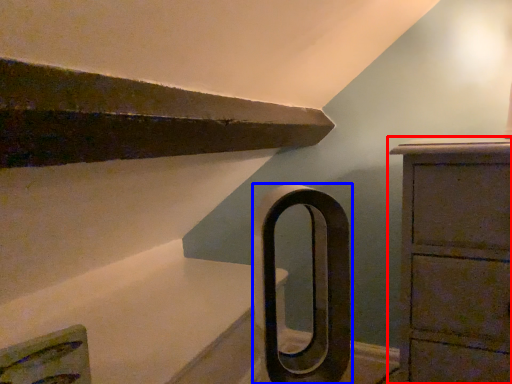
Question: Among these objects, which one is farthest to the camera, chest of drawers (highlighted by a red box) or door handle (highlighted by a blue box)?

Choices:
 (A) chest of drawers
 (B) door handle

Answer: (A)